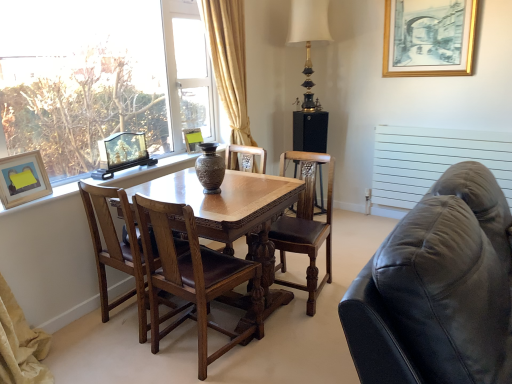
Question: In which direction should I rotate to look at brown leather chair at center, which ranks as the 3th chair in right-to-left order?

Choices:
 (A) left
 (B) right

Answer: (A)

Question: Is gold-framed print at upper right, which is counted as the 1th picture frame, starting from the top, outside of matte black picture frame at center, marked as the third picture frame in a left-to-right arrangement?

Choices:
 (A) yes
 (B) no

Answer: (A)

Question: From the image's perspective, is gold-framed print at upper right, which is the first picture frame from right to left, beneath matte black picture frame at center, the 3th picture frame from the bottom?

Choices:
 (A) no
 (B) yes

Answer: (A)

Question: From the image's perspective, does gold-framed print at upper right, which is counted as the fourth picture frame, starting from the left, appear higher than matte black picture frame at center, which is the second picture frame from top to bottom?

Choices:
 (A) yes
 (B) no

Answer: (A)

Question: From a real-world perspective, is gold-framed print at upper right, the 2th picture frame from the back, positioned over matte black picture frame at center, marked as the third picture frame in a left-to-right arrangement, based on gravity?

Choices:
 (A) yes
 (B) no

Answer: (A)

Question: Considering the relative sizes of gold-framed print at upper right, which is counted as the 1th picture frame, starting from the top, and matte black picture frame at center, marked as the 4th picture frame in a front-to-back arrangement, in the image provided, is gold-framed print at upper right, which is counted as the 1th picture frame, starting from the top, taller than matte black picture frame at center, marked as the 4th picture frame in a front-to-back arrangement,?

Choices:
 (A) yes
 (B) no

Answer: (A)

Question: Is gold-framed print at upper right, which is counted as the 1th picture frame, starting from the top, aimed at matte black picture frame at center, which is the second picture frame from top to bottom?

Choices:
 (A) no
 (B) yes

Answer: (A)

Question: Is black matte speaker at center surrounded by white matte radiator at right?

Choices:
 (A) no
 (B) yes

Answer: (A)

Question: Would you say white matte radiator at right is outside black matte speaker at center?

Choices:
 (A) no
 (B) yes

Answer: (B)

Question: Is white matte radiator at right facing towards black matte speaker at center?

Choices:
 (A) no
 (B) yes

Answer: (A)

Question: Is white matte radiator at right directly adjacent to black matte speaker at center?

Choices:
 (A) yes
 (B) no

Answer: (B)

Question: Is white matte radiator at right wider than black matte speaker at center?

Choices:
 (A) yes
 (B) no

Answer: (B)

Question: Is white matte radiator at right positioned behind black matte speaker at center?

Choices:
 (A) yes
 (B) no

Answer: (B)

Question: Does brown leather chair at center, which appears as the first chair when viewed from the left, appear on the right side of black matte speaker at center?

Choices:
 (A) yes
 (B) no

Answer: (B)